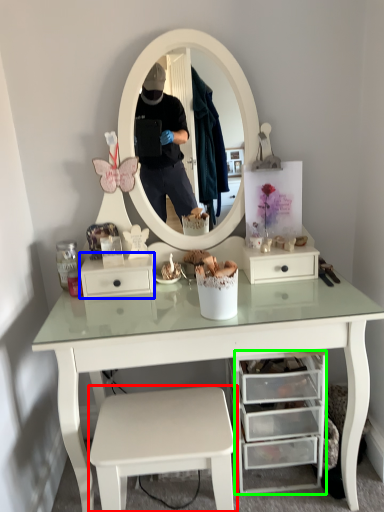
Question: Which object is positioned closest to stool (highlighted by a red box)? Select from drawer (highlighted by a blue box) and drawer (highlighted by a green box).

Choices:
 (A) drawer
 (B) drawer

Answer: (B)